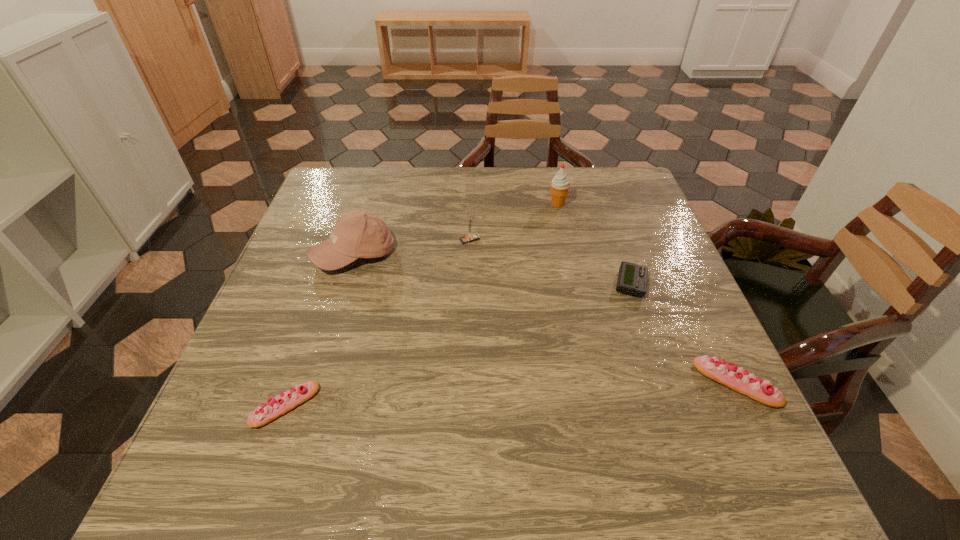
The image size is (960, 540). What are the coordinates of `the shorter eclair` in the screenshot? It's located at (281, 404).

The height and width of the screenshot is (540, 960). In order to click on the second shortest object in this screenshot , I will do `click(281, 404)`.

You are a GUI agent. You are given a task and a screenshot of the screen. Output one action in this format:
    pyautogui.click(x=<x>, y=<y>)
    Task: Click on the right eclair
    Image resolution: width=960 pixels, height=540 pixels.
    Given the screenshot: What is the action you would take?
    pyautogui.click(x=730, y=375)

Find the location of a particular element. The height and width of the screenshot is (540, 960). the taller eclair is located at coordinates (730, 375).

Locate an element on the screen. the fourth object from left to right is located at coordinates (560, 184).

Image resolution: width=960 pixels, height=540 pixels. I want to click on the tallest object, so click(x=560, y=184).

Where is `the shortest object`? the shortest object is located at coordinates (632, 279).

I want to click on the fifth object from left to right, so click(632, 279).

Where is `the third tallest object`? The height and width of the screenshot is (540, 960). the third tallest object is located at coordinates (470, 237).

The image size is (960, 540). Identify the location of the fourth object from right to left. (470, 237).